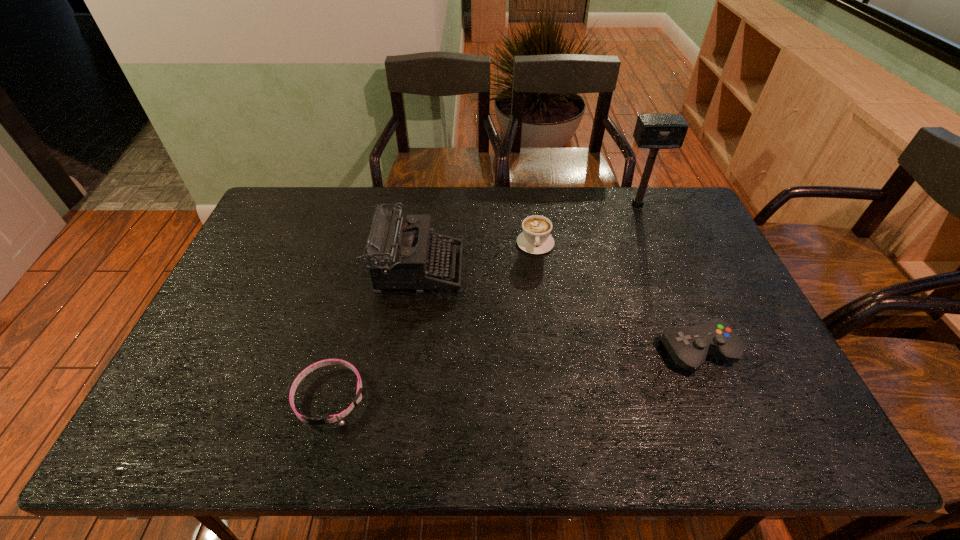
Image resolution: width=960 pixels, height=540 pixels. In order to click on mallet in this screenshot , I will do `click(654, 131)`.

Locate an element on the screen. Image resolution: width=960 pixels, height=540 pixels. the farthest object is located at coordinates (654, 131).

The height and width of the screenshot is (540, 960). Find the location of `the fourth shortest object`. the fourth shortest object is located at coordinates (400, 249).

In order to click on the third object from left to right in this screenshot , I will do coord(535,239).

You are a GUI agent. You are given a task and a screenshot of the screen. Output one action in this format:
    pyautogui.click(x=<x>, y=<y>)
    Task: Click on the control
    This screenshot has width=960, height=540.
    Given the screenshot: What is the action you would take?
    pyautogui.click(x=688, y=346)

This screenshot has width=960, height=540. I want to click on the shortest object, so click(x=359, y=393).

Where is `vacant space situated on the left of the mallet`? The width and height of the screenshot is (960, 540). vacant space situated on the left of the mallet is located at coordinates (579, 205).

Identify the location of vacant space situated on the typing side of the second tallest object. The height and width of the screenshot is (540, 960). (570, 269).

Find the location of a particular element. This screenshot has height=540, width=960. vacant space located 0.070m to the right of the cappuccino's handle is located at coordinates (540, 273).

Where is `vacant space situated on the left of the control`? Image resolution: width=960 pixels, height=540 pixels. vacant space situated on the left of the control is located at coordinates (634, 352).